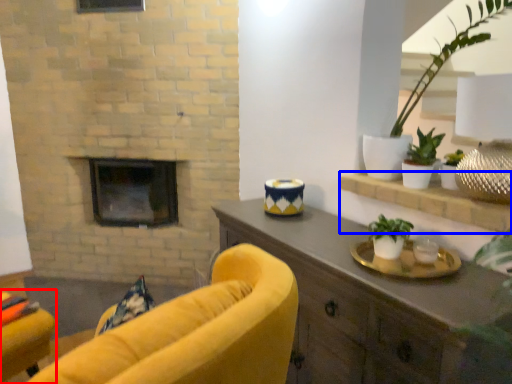
Question: Among these objects, which one is nearest to the camera, chair (highlighted by a red box) or shelf (highlighted by a blue box)?

Choices:
 (A) chair
 (B) shelf

Answer: (B)